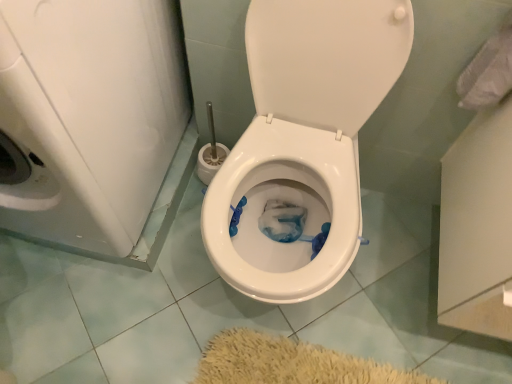
Question: Does white fabric at upper right have a lesser height compared to white glossy toilet at center?

Choices:
 (A) yes
 (B) no

Answer: (A)

Question: Is white fabric at upper right to the right of white glossy toilet at center from the viewer's perspective?

Choices:
 (A) yes
 (B) no

Answer: (A)

Question: Considering the relative sizes of white fabric at upper right and white glossy toilet at center in the image provided, is white fabric at upper right thinner than white glossy toilet at center?

Choices:
 (A) no
 (B) yes

Answer: (B)

Question: From a real-world perspective, is white fabric at upper right under white glossy toilet at center?

Choices:
 (A) no
 (B) yes

Answer: (A)

Question: Is white fabric at upper right facing away from white glossy toilet at center?

Choices:
 (A) no
 (B) yes

Answer: (A)

Question: Considering their positions, is white glossy toilet at center located in front of or behind white glossy washer at left?

Choices:
 (A) behind
 (B) front

Answer: (A)

Question: Is white glossy toilet at center inside or outside of white glossy washer at left?

Choices:
 (A) inside
 (B) outside

Answer: (B)

Question: Is white glossy toilet at center wider or thinner than white glossy washer at left?

Choices:
 (A) thin
 (B) wide

Answer: (A)

Question: From the image's perspective, is white glossy toilet at center above or below white glossy washer at left?

Choices:
 (A) below
 (B) above

Answer: (A)

Question: From the image's perspective, is white glossy washer at left located above or below white fabric at upper right?

Choices:
 (A) above
 (B) below

Answer: (B)

Question: Considering the positions of white glossy washer at left and white fabric at upper right in the image, is white glossy washer at left taller or shorter than white fabric at upper right?

Choices:
 (A) tall
 (B) short

Answer: (A)

Question: In terms of size, does white glossy washer at left appear bigger or smaller than white fabric at upper right?

Choices:
 (A) big
 (B) small

Answer: (A)

Question: In terms of width, does white glossy washer at left look wider or thinner when compared to white fabric at upper right?

Choices:
 (A) thin
 (B) wide

Answer: (B)

Question: In terms of height, does white glossy washer at left look taller or shorter compared to white glossy toilet at center?

Choices:
 (A) tall
 (B) short

Answer: (A)

Question: Looking at their shapes, would you say white glossy washer at left is wider or thinner than white glossy toilet at center?

Choices:
 (A) thin
 (B) wide

Answer: (B)